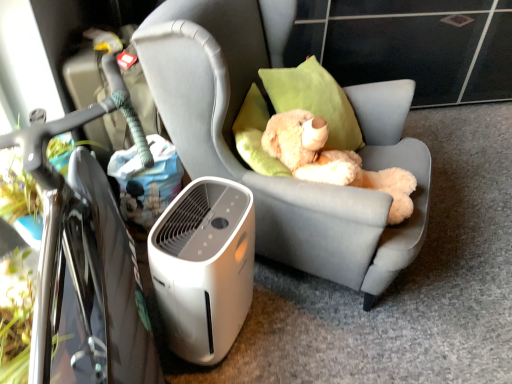
Identify the location of vacant area that is situated to the right of light gray fabric chair at center. (460, 264).